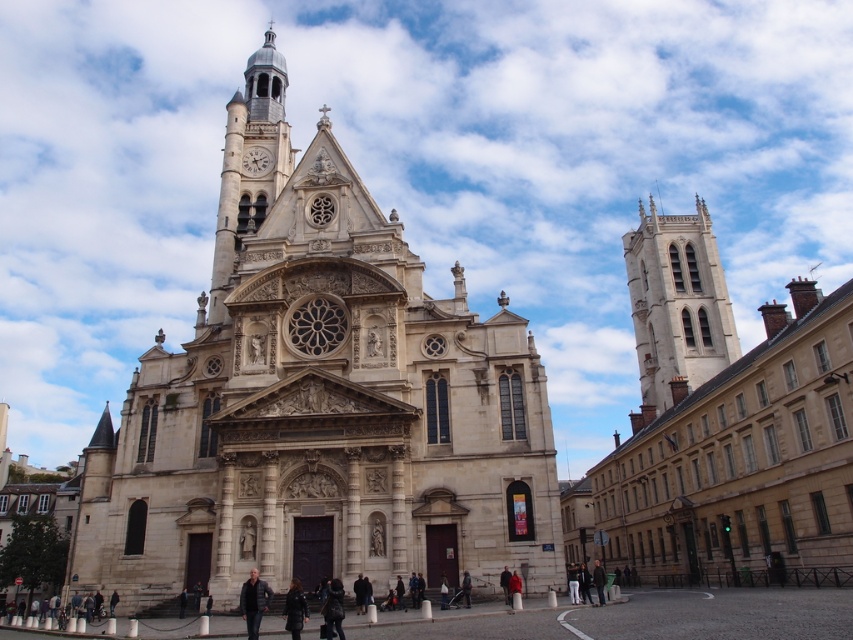
Question: Which object is closer to the camera taking this photo?

Choices:
 (A) leather jacket at lower center
 (B) light beige stone tower at right
 (C) polished stone clock tower at upper left

Answer: (A)

Question: Considering the relative positions of leather jacket at lower center and red jacket at center in the image provided, where is leather jacket at lower center located with respect to red jacket at center?

Choices:
 (A) below
 (B) above

Answer: (B)

Question: Which object is positioned closest to the leather jacket at lower center?

Choices:
 (A) dark brown leather jacket at center
 (B) polished stone clock tower at upper left
 (C) white stone tower at right
 (D) dark gray leather jacket at center

Answer: (A)

Question: Which of these objects is positioned farthest from the leather jacket at lower center?

Choices:
 (A) polished stone clock tower at upper left
 (B) light beige stone tower at right
 (C) dark gray leather jacket at center
 (D) white stone tower at right

Answer: (D)

Question: Is light beige stone church at center closer to camera compared to light beige stone tower at right?

Choices:
 (A) no
 (B) yes

Answer: (B)

Question: Is light beige stone tower at right further to the viewer compared to dark brown leather jacket at center?

Choices:
 (A) yes
 (B) no

Answer: (A)